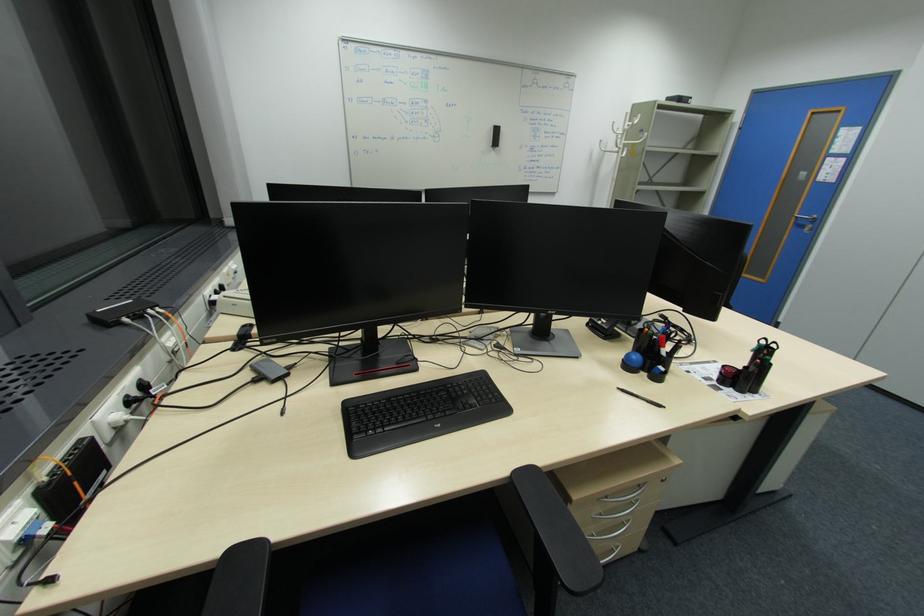
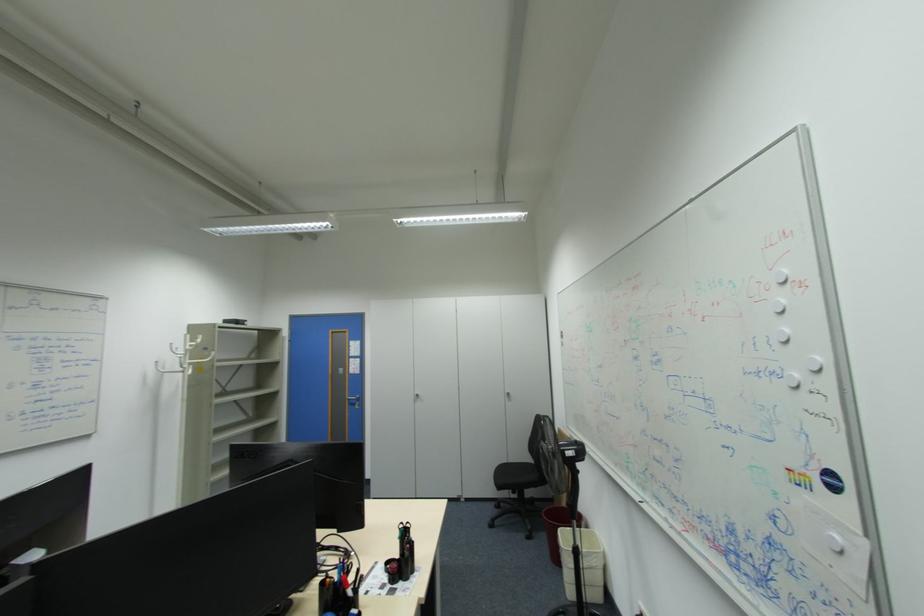
Question: The camera is either moving clockwise (left) or counter-clockwise (right) around the object. The first image is from the beginning of the video and the second image is from the end. Is the camera moving left or right when shooting the video?

Choices:
 (A) Left
 (B) Right

Answer: (A)